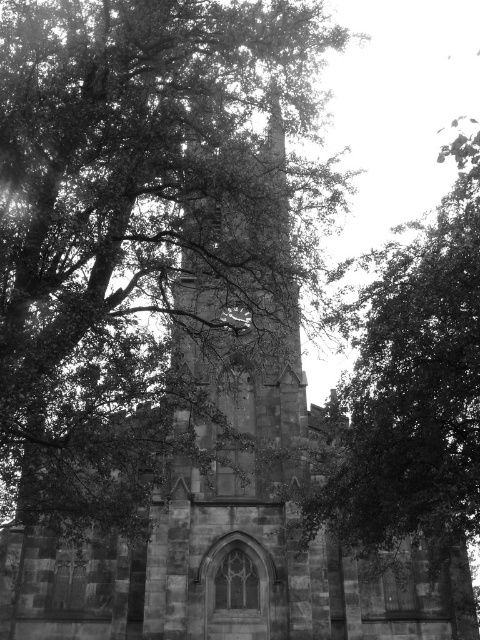
Between stone clock tower at center and metallic gray clock at center, which one is positioned lower?

metallic gray clock at center

Who is taller, stone clock tower at center or metallic gray clock at center?

stone clock tower at center is taller.

Does point (273, 228) come in front of point (238, 308)?

Yes, point (273, 228) is in front of point (238, 308).

Find the location of a particular element. The width and height of the screenshot is (480, 640). stone clock tower at center is located at coordinates (240, 339).

Can you confirm if dark green leafy tree at center is positioned above metallic gray clock at center?

Yes, dark green leafy tree at center is above metallic gray clock at center.

Who is shorter, dark green leafy tree at center or metallic gray clock at center?

metallic gray clock at center

Is point (420, 492) positioned before point (237, 330)?

Yes, point (420, 492) is in front of point (237, 330).

Identify the location of dark green leafy tree at center. This screenshot has height=640, width=480. (412, 385).

Between point (358, 500) and point (184, 378), which one is positioned in front?

Point (358, 500) is more forward.

Is point (319, 508) behind point (231, 374)?

No, (319, 508) is in front of (231, 374).

The height and width of the screenshot is (640, 480). I want to click on dark green leafy tree at center, so pyautogui.click(x=412, y=385).